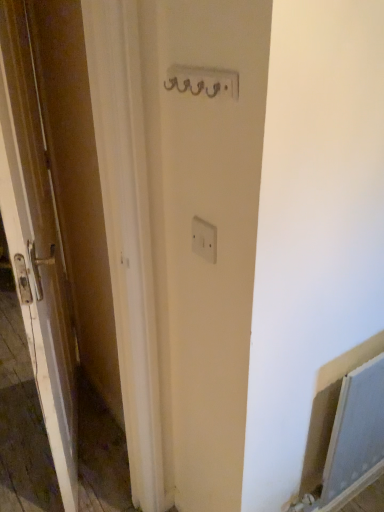
What do you see at coordinates (204, 239) in the screenshot? I see `white plastic electric outlet at center` at bounding box center [204, 239].

Where is `white plastic electric outlet at center`? Image resolution: width=384 pixels, height=512 pixels. white plastic electric outlet at center is located at coordinates (204, 239).

At what (x,y) coordinates should I click in order to perform the action: click on white plastic electric outlet at center. Please return your answer as a coordinate pair (x, y). Image resolution: width=384 pixels, height=512 pixels. Looking at the image, I should click on (204, 239).